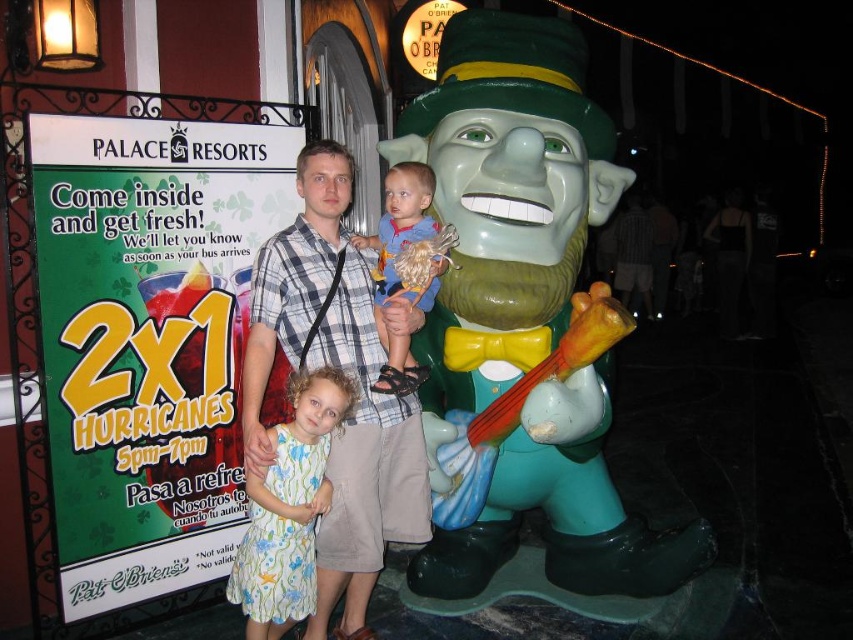
Question: Which object appears closest to the camera in this image?

Choices:
 (A) green painted statue at right
 (B) plaid shirt at center

Answer: (B)

Question: Is the position of green painted statue at right more distant than that of plaid shirt at center?

Choices:
 (A) yes
 (B) no

Answer: (A)

Question: Estimate the real-world distances between objects in this image. Which object is closer to the blue cotton shirt at center?

Choices:
 (A) plaid shirt at center
 (B) floral cotton dress at center

Answer: (A)

Question: Which point is closer to the camera taking this photo?

Choices:
 (A) (397, 292)
 (B) (485, 77)
 (C) (373, 456)

Answer: (A)

Question: Is plaid shirt at center to the right of floral cotton dress at center from the viewer's perspective?

Choices:
 (A) no
 (B) yes

Answer: (B)

Question: Considering the relative positions of plaid shirt at center and blue cotton shirt at center in the image provided, where is plaid shirt at center located with respect to blue cotton shirt at center?

Choices:
 (A) right
 (B) left

Answer: (B)